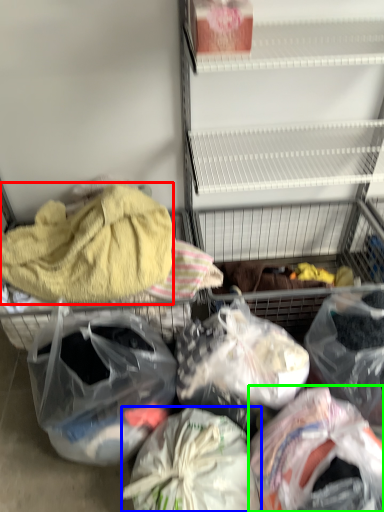
Question: Which object is the farthest from towel/napkin (highlighted by a red box)? Choose among these: plastic bag (highlighted by a blue box) or plastic bag (highlighted by a green box).

Choices:
 (A) plastic bag
 (B) plastic bag

Answer: (B)